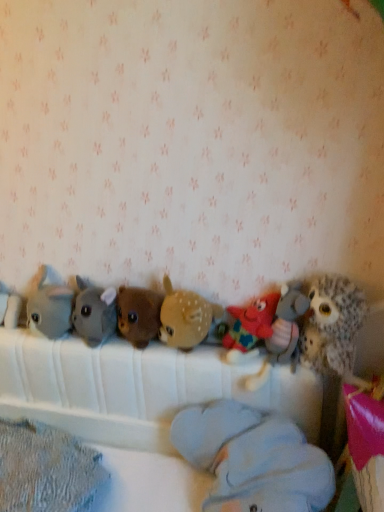
Describe the element at coordinates (10, 308) in the screenshot. This screenshot has width=384, height=512. I see `white plush elephant at left, positioned as the 9th toy in right-to-left order` at that location.

Describe the element at coordinates (282, 333) in the screenshot. I see `multicolored plush starfish at center, marked as the second toy in a right-to-left arrangement` at that location.

Image resolution: width=384 pixels, height=512 pixels. What do you see at coordinates (332, 325) in the screenshot?
I see `fuzzy brown owl at right, which is counted as the 1th toy, starting from the right` at bounding box center [332, 325].

How much space does brown fuzzy deer at center, marked as the fifth toy in a left-to-right arrangement, occupy vertically?

brown fuzzy deer at center, marked as the fifth toy in a left-to-right arrangement, is 8.13 inches tall.

Find the location of a particular element. The image size is (384, 512). brown fuzzy deer at center, marked as the fifth toy in a left-to-right arrangement is located at coordinates (185, 317).

Locate an element on the screen. brown plush bear at center, which appears as the 4th toy when viewed from the left is located at coordinates (138, 314).

Find the location of a particular element. The width and height of the screenshot is (384, 512). light blue plush at center, positioned as the fourth toy in right-to-left order is located at coordinates (253, 459).

In order to face light blue plush at center, positioned as the fourth toy in right-to-left order, should I rotate leftwards or rightwards?

Turn right by 5.819 degrees to look at light blue plush at center, positioned as the fourth toy in right-to-left order.

You are a GUI agent. You are given a task and a screenshot of the screen. Output one action in this format:
    pyautogui.click(x=<x>, y=<y>)
    Task: Click on the soft gray plush at center, marked as the 7th toy in a right-to-left arrangement
    This screenshot has height=512, width=384.
    Given the screenshot: What is the action you would take?
    pyautogui.click(x=94, y=313)

At what (x,y) coordinates should I click in order to perform the action: click on the 4th toy below when counting from the gray plush toy at left, acting as the eighth toy starting from the right (from the image's perspective). Please return your answer as a coordinate pair (x, y). This screenshot has height=512, width=384. Looking at the image, I should click on (138, 314).

Who is taller, brown plush bear at center, which appears as the sixth toy when viewed from the right, or gray plush toy at left, marked as the second toy in a left-to-right arrangement?

gray plush toy at left, marked as the second toy in a left-to-right arrangement, is taller.

Does brown plush bear at center, which appears as the sixth toy when viewed from the right, turn towards gray plush toy at left, marked as the second toy in a left-to-right arrangement?

No, brown plush bear at center, which appears as the sixth toy when viewed from the right, is not oriented towards gray plush toy at left, marked as the second toy in a left-to-right arrangement.

Find the location of `the 2nd toy to the left of the fuzzy brown owl at right, which is counted as the 1th toy, starting from the right, counting from the anchor's position`. the 2nd toy to the left of the fuzzy brown owl at right, which is counted as the 1th toy, starting from the right, counting from the anchor's position is located at coordinates (250, 327).

From the image's perspective, is multicolored fabric star at center, the 3th toy positioned from the right, located beneath fuzzy brown owl at right, which is the ninth toy in left-to-right order?

Correct, multicolored fabric star at center, the 3th toy positioned from the right, appears lower than fuzzy brown owl at right, which is the ninth toy in left-to-right order, in the image.

From the picture: Choose the correct answer: Is multicolored fabric star at center, the 3th toy positioned from the right, inside fuzzy brown owl at right, which is counted as the 1th toy, starting from the right, or outside it?

The correct answer is: outside.

Can you confirm if multicolored fabric star at center, arranged as the seventh toy when viewed from the left, is bigger than soft gray plush at center, the third toy in the left-to-right sequence?

Incorrect, multicolored fabric star at center, arranged as the seventh toy when viewed from the left, is not larger than soft gray plush at center, the third toy in the left-to-right sequence.

From the image's perspective, which object appears higher, multicolored fabric star at center, arranged as the seventh toy when viewed from the left, or soft gray plush at center, marked as the 7th toy in a right-to-left arrangement?

soft gray plush at center, marked as the 7th toy in a right-to-left arrangement, appears higher in the image.

Is multicolored fabric star at center, arranged as the seventh toy when viewed from the left, with soft gray plush at center, the third toy in the left-to-right sequence?

No, multicolored fabric star at center, arranged as the seventh toy when viewed from the left, is not beside soft gray plush at center, the third toy in the left-to-right sequence.

Which is in front, multicolored fabric star at center, the 3th toy positioned from the right, or soft gray plush at center, marked as the 7th toy in a right-to-left arrangement?

multicolored fabric star at center, the 3th toy positioned from the right.

Is brown plush bear at center, which appears as the sixth toy when viewed from the right, positioned with its back to brown fuzzy deer at center, marked as the fifth toy in a left-to-right arrangement?

brown plush bear at center, which appears as the sixth toy when viewed from the right, does not have its back to brown fuzzy deer at center, marked as the fifth toy in a left-to-right arrangement.

Is brown plush bear at center, which appears as the 4th toy when viewed from the left, smaller than brown fuzzy deer at center, marked as the fifth toy in a left-to-right arrangement?

Yes.

Where is `the 1st toy to the right of the brown plush bear at center, which appears as the 4th toy when viewed from the left, counting from the anchor's position`? This screenshot has width=384, height=512. the 1st toy to the right of the brown plush bear at center, which appears as the 4th toy when viewed from the left, counting from the anchor's position is located at coordinates (185, 317).

Is brown plush bear at center, which appears as the sixth toy when viewed from the right, beside brown fuzzy deer at center, positioned as the fifth toy in right-to-left order?

Yes, brown plush bear at center, which appears as the sixth toy when viewed from the right, is with brown fuzzy deer at center, positioned as the fifth toy in right-to-left order.

Is gray plush toy at left, marked as the second toy in a left-to-right arrangement, a part of multicolored plush starfish at center, marked as the second toy in a right-to-left arrangement?

No, gray plush toy at left, marked as the second toy in a left-to-right arrangement, is not inside multicolored plush starfish at center, marked as the second toy in a right-to-left arrangement.

Between multicolored plush starfish at center, marked as the second toy in a right-to-left arrangement, and gray plush toy at left, marked as the second toy in a left-to-right arrangement, which one has larger size?

Bigger between the two is multicolored plush starfish at center, marked as the second toy in a right-to-left arrangement.

Does multicolored plush starfish at center, marked as the 8th toy in a left-to-right arrangement, have a greater width compared to gray plush toy at left, acting as the eighth toy starting from the right?

Yes, multicolored plush starfish at center, marked as the 8th toy in a left-to-right arrangement, is wider than gray plush toy at left, acting as the eighth toy starting from the right.

Considering the positions of point (263, 370) and point (48, 302), is point (263, 370) closer or farther from the camera than point (48, 302)?

Point (263, 370) appears to be closer to the viewer than point (48, 302).

From the image's perspective, does white plush elephant at left, positioned as the 9th toy in right-to-left order, appear lower than fuzzy brown owl at right, which is the ninth toy in left-to-right order?

No.

Is the position of white plush elephant at left, which ranks as the first toy in left-to-right order, more distant than that of fuzzy brown owl at right, which is counted as the 1th toy, starting from the right?

Yes, the depth of white plush elephant at left, which ranks as the first toy in left-to-right order, is greater than that of fuzzy brown owl at right, which is counted as the 1th toy, starting from the right.

The width and height of the screenshot is (384, 512). I want to click on the 7th toy behind the fuzzy brown owl at right, which is counted as the 1th toy, starting from the right, counting from the anchor's position, so click(10, 308).

Considering the relative sizes of brown fuzzy deer at center, positioned as the fifth toy in right-to-left order, and brown plush bear at center, which appears as the sixth toy when viewed from the right, in the image provided, is brown fuzzy deer at center, positioned as the fifth toy in right-to-left order, bigger than brown plush bear at center, which appears as the sixth toy when viewed from the right,?

Indeed, brown fuzzy deer at center, positioned as the fifth toy in right-to-left order, has a larger size compared to brown plush bear at center, which appears as the sixth toy when viewed from the right.

From the image's perspective, is brown fuzzy deer at center, positioned as the fifth toy in right-to-left order, above or below brown plush bear at center, which appears as the sixth toy when viewed from the right?

From the image's perspective, brown fuzzy deer at center, positioned as the fifth toy in right-to-left order, appears above brown plush bear at center, which appears as the sixth toy when viewed from the right.

Between brown fuzzy deer at center, marked as the fifth toy in a left-to-right arrangement, and brown plush bear at center, which appears as the 4th toy when viewed from the left, which one is positioned in front?

brown fuzzy deer at center, marked as the fifth toy in a left-to-right arrangement.

Is brown plush bear at center, which appears as the 4th toy when viewed from the left, completely or partially inside brown fuzzy deer at center, marked as the fifth toy in a left-to-right arrangement?

No, brown fuzzy deer at center, marked as the fifth toy in a left-to-right arrangement, does not contain brown plush bear at center, which appears as the 4th toy when viewed from the left.

From a real-world perspective, starting from the brown plush bear at center, which appears as the 4th toy when viewed from the left, which toy is the 2nd one vertically above it? Please provide its 2D coordinates.

[(50, 309)]

From the image's perspective, starting from the fuzzy brown owl at right, which is counted as the 1th toy, starting from the right, which toy is the 2nd one below? Please provide its 2D coordinates.

[(250, 327)]

When comparing their distances from gray plush toy at left, acting as the eighth toy starting from the right, does light blue plush at center, positioned as the fourth toy in right-to-left order, or soft gray plush at center, the third toy in the left-to-right sequence, seem closer?

The object closer to gray plush toy at left, acting as the eighth toy starting from the right, is soft gray plush at center, the third toy in the left-to-right sequence.

Estimate the real-world distances between objects in this image. Which object is further from soft gray plush at center, the third toy in the left-to-right sequence, brown fuzzy deer at center, marked as the fifth toy in a left-to-right arrangement, or light blue plush at center, marked as the 6th toy in a left-to-right arrangement?

light blue plush at center, marked as the 6th toy in a left-to-right arrangement, is further to soft gray plush at center, the third toy in the left-to-right sequence.

Based on their spatial positions, is fuzzy brown owl at right, which is counted as the 1th toy, starting from the right, or multicolored fabric star at center, the 3th toy positioned from the right, further from gray plush toy at left, marked as the second toy in a left-to-right arrangement?

fuzzy brown owl at right, which is counted as the 1th toy, starting from the right, is positioned further to the anchor gray plush toy at left, marked as the second toy in a left-to-right arrangement.

When comparing their distances from multicolored fabric star at center, arranged as the seventh toy when viewed from the left, does brown fuzzy deer at center, positioned as the fifth toy in right-to-left order, or brown plush bear at center, which appears as the sixth toy when viewed from the right, seem further?

brown plush bear at center, which appears as the sixth toy when viewed from the right, is further to multicolored fabric star at center, arranged as the seventh toy when viewed from the left.

Which object lies further to the anchor point soft gray plush at center, the third toy in the left-to-right sequence, white plush elephant at left, which ranks as the first toy in left-to-right order, or fuzzy brown owl at right, which is counted as the 1th toy, starting from the right?

fuzzy brown owl at right, which is counted as the 1th toy, starting from the right, is positioned further to the anchor soft gray plush at center, the third toy in the left-to-right sequence.

Based on their spatial positions, is brown fuzzy deer at center, positioned as the fifth toy in right-to-left order, or light blue plush at center, marked as the 6th toy in a left-to-right arrangement, closer to brown plush bear at center, which appears as the 4th toy when viewed from the left?

brown fuzzy deer at center, positioned as the fifth toy in right-to-left order, is closer to brown plush bear at center, which appears as the 4th toy when viewed from the left.

Based on the photo, looking at the image, which one is located further to light blue plush at center, positioned as the fourth toy in right-to-left order, soft gray plush at center, marked as the 7th toy in a right-to-left arrangement, or brown fuzzy deer at center, marked as the fifth toy in a left-to-right arrangement?

soft gray plush at center, marked as the 7th toy in a right-to-left arrangement, lies further to light blue plush at center, positioned as the fourth toy in right-to-left order, than the other object.

Considering their positions, is brown plush bear at center, which appears as the 4th toy when viewed from the left, positioned closer to brown fuzzy deer at center, positioned as the fifth toy in right-to-left order, than multicolored plush starfish at center, marked as the 8th toy in a left-to-right arrangement?

brown plush bear at center, which appears as the 4th toy when viewed from the left, lies closer to brown fuzzy deer at center, positioned as the fifth toy in right-to-left order, than the other object.

Locate an element on the screen. toy between gray plush toy at left, marked as the second toy in a left-to-right arrangement, and brown plush bear at center, which appears as the sixth toy when viewed from the right, in the horizontal direction is located at coordinates (94, 313).

Locate an element on the screen. The image size is (384, 512). toy located between white plush elephant at left, which ranks as the first toy in left-to-right order, and soft gray plush at center, marked as the 7th toy in a right-to-left arrangement, in the left-right direction is located at coordinates (50, 309).

The width and height of the screenshot is (384, 512). In order to click on toy situated between multicolored fabric star at center, the 3th toy positioned from the right, and fuzzy brown owl at right, which is counted as the 1th toy, starting from the right, from left to right in this screenshot , I will do `click(282, 333)`.

Find the location of a particular element. The height and width of the screenshot is (512, 384). toy between multicolored fabric star at center, arranged as the seventh toy when viewed from the left, and light blue plush at center, marked as the 6th toy in a left-to-right arrangement, in the up-down direction is located at coordinates (282, 333).